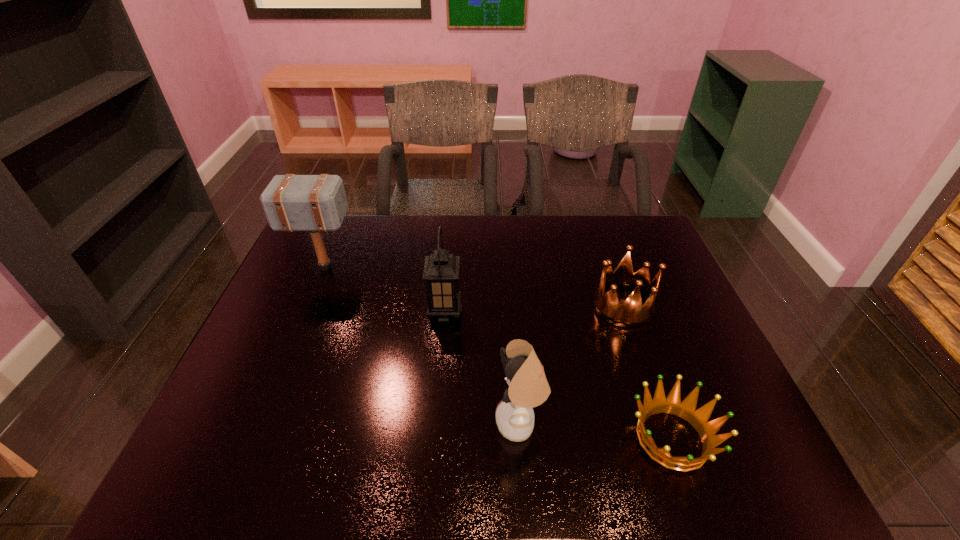
Locate an element on the screen. unoccupied area between the fourth tallest object and the mallet is located at coordinates (473, 287).

You are a GUI agent. You are given a task and a screenshot of the screen. Output one action in this format:
    pyautogui.click(x=<x>, y=<y>)
    Task: Click on the vacant space in between the nearer crown and the lantern
    This screenshot has height=540, width=960.
    Given the screenshot: What is the action you would take?
    pyautogui.click(x=559, y=375)

The height and width of the screenshot is (540, 960). In order to click on free space between the third object from left to right and the nearer crown in this screenshot , I will do `click(596, 431)`.

Locate an element on the screen. This screenshot has width=960, height=540. vacant space that's between the second object from left to right and the farther crown is located at coordinates (534, 309).

Find the location of a particular element. This screenshot has width=960, height=540. vacant region between the farthest object and the fourth object from right to left is located at coordinates (385, 290).

Where is `empty space between the second shortest object and the doll`? The height and width of the screenshot is (540, 960). empty space between the second shortest object and the doll is located at coordinates (571, 364).

Locate an element on the screen. The height and width of the screenshot is (540, 960). object that is the third closest to the lantern is located at coordinates (631, 313).

I want to click on object that is the second nearest to the doll, so click(x=441, y=270).

Image resolution: width=960 pixels, height=540 pixels. Find the location of `blank area in the image that satisfies the following two spatial constraints: 1. on the striking surface of the mallet; 2. on the right side of the second object from left to right`. blank area in the image that satisfies the following two spatial constraints: 1. on the striking surface of the mallet; 2. on the right side of the second object from left to right is located at coordinates (306, 313).

The width and height of the screenshot is (960, 540). I want to click on vacant position in the image that satisfies the following two spatial constraints: 1. on the front side of the farther crown; 2. on the left side of the shorter crown, so click(668, 438).